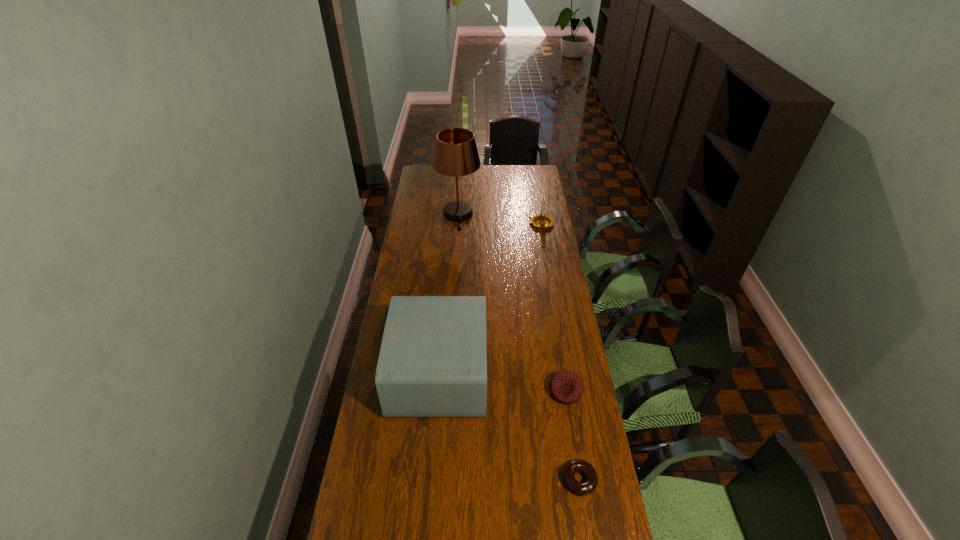
You are a GUI agent. You are given a task and a screenshot of the screen. Output one action in this format:
    pyautogui.click(x=<x>, y=<y>)
    Task: Click on the free space located 0.390m on the left of the nearest object
    
    Given the screenshot: What is the action you would take?
    pyautogui.click(x=431, y=480)

Image resolution: width=960 pixels, height=540 pixels. What are the coordinates of `lampshade located at the left edge` in the screenshot? It's located at (455, 154).

I want to click on radio receiver that is at the left edge, so click(x=433, y=358).

The width and height of the screenshot is (960, 540). I want to click on candle holder positioned at the right edge, so click(542, 220).

Where is `beanbag that is at the right edge`? The image size is (960, 540). beanbag that is at the right edge is located at coordinates (566, 386).

Locate an element on the screen. The image size is (960, 540). doughnut present at the right edge is located at coordinates (584, 488).

The height and width of the screenshot is (540, 960). I want to click on vacant space at the far edge, so click(512, 176).

You are a GUI agent. You are given a task and a screenshot of the screen. Output one action in this format:
    pyautogui.click(x=<x>, y=<y>)
    Task: Click on the vacant space at the left edge of the desktop
    
    Given the screenshot: What is the action you would take?
    pyautogui.click(x=431, y=280)

You are a GUI agent. You are given a task and a screenshot of the screen. Output one action in this format:
    pyautogui.click(x=<x>, y=<y>)
    Task: Click on the free space at the right edge of the desktop
    
    Given the screenshot: What is the action you would take?
    pyautogui.click(x=555, y=359)

Find the location of a particular element. vacant area that lies between the third tallest object and the fourth tallest object is located at coordinates (553, 307).